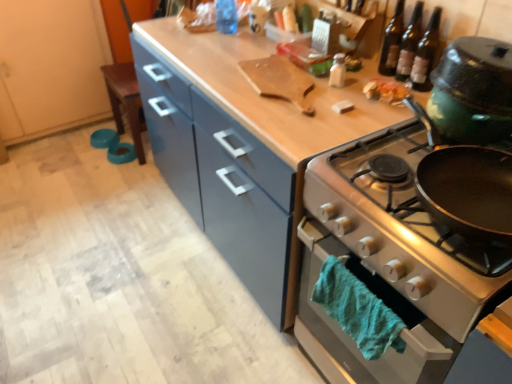
Where is `vacant area situated to the left side of clear glass bottles at upper right`? vacant area situated to the left side of clear glass bottles at upper right is located at coordinates (348, 85).